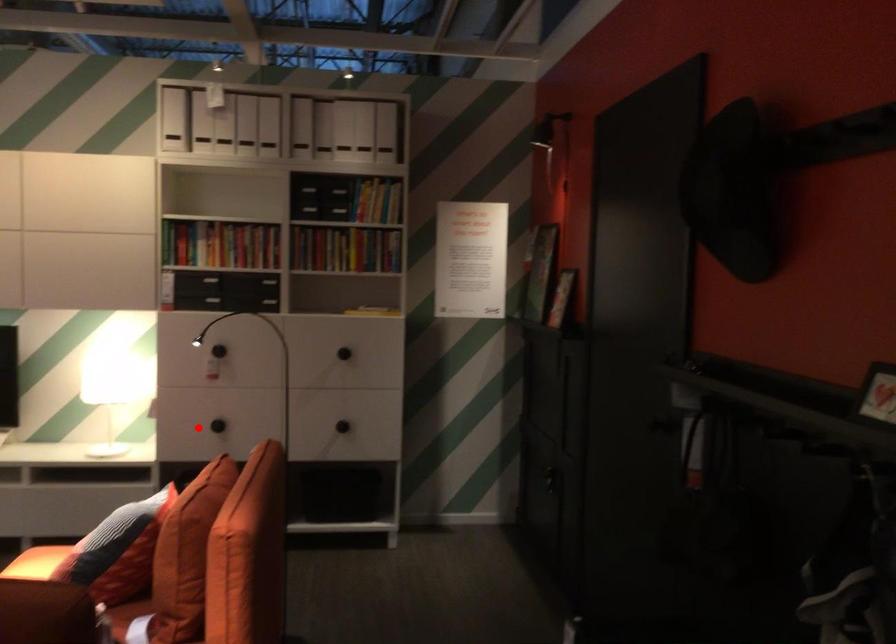
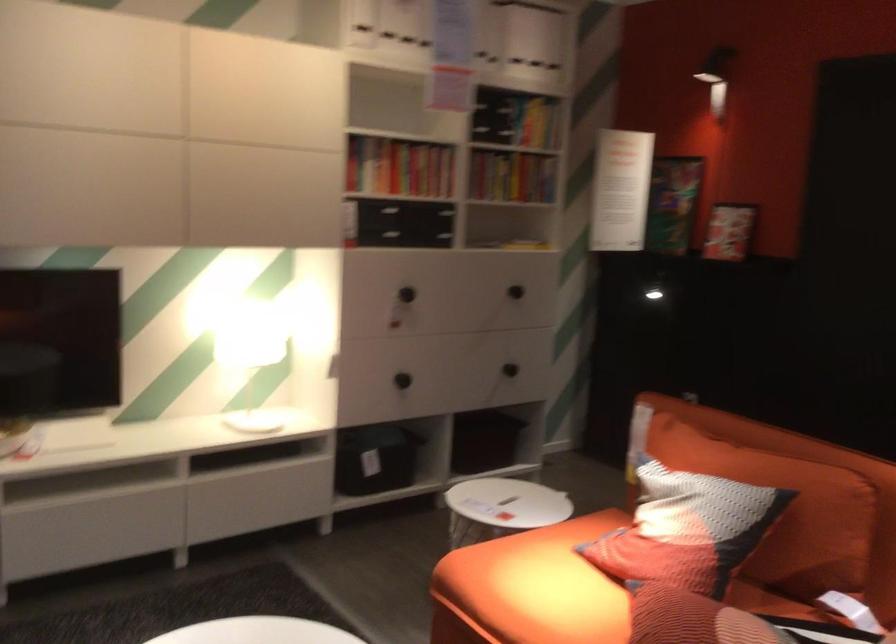
Question: A red point is marked in image1. In image2, is the corresponding 3D point closer to the camera or farther? Reply with the corresponding letter.

Choices:
 (A) The corresponding 3D point is closer.
 (B) The corresponding 3D point is farther.

Answer: (A)